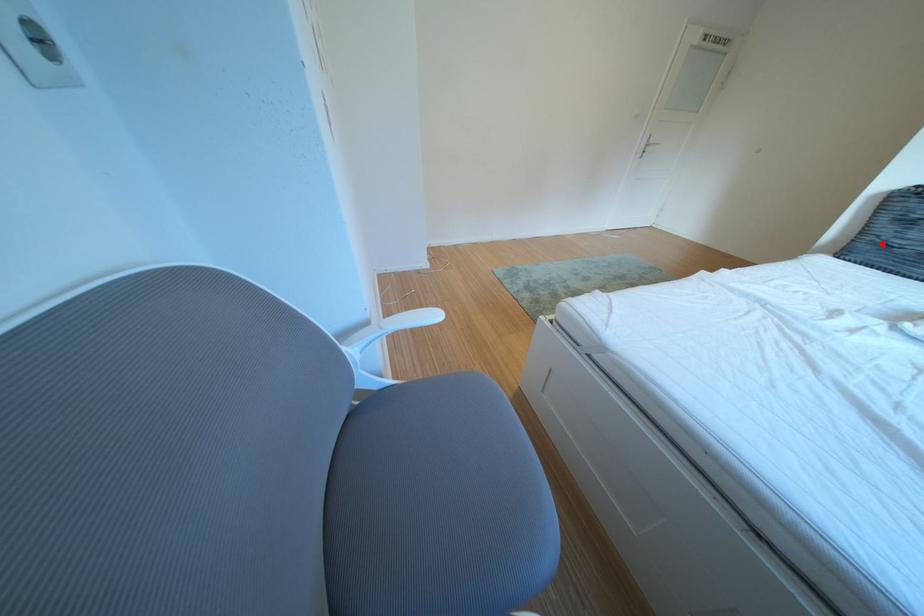
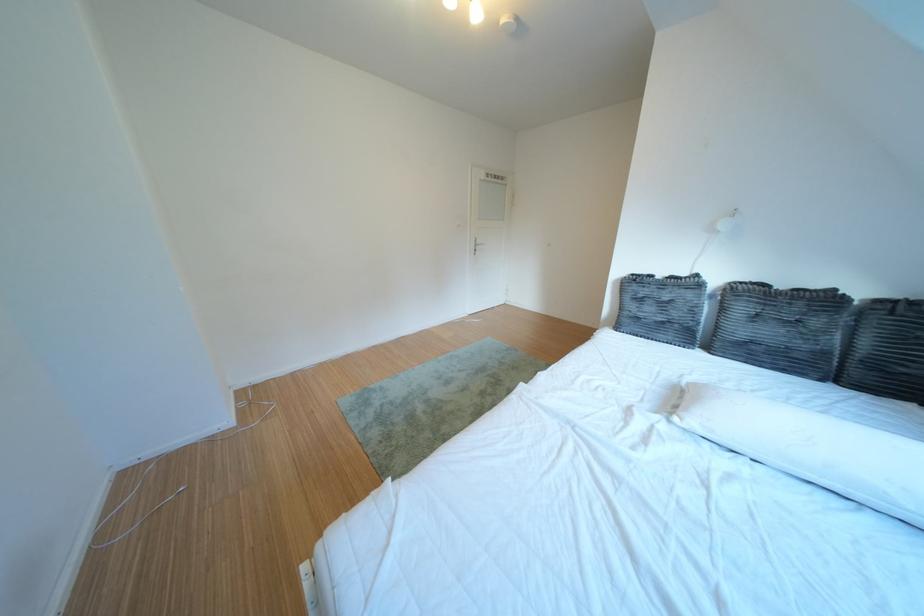
Locate, in the second image, the point that corresponds to the highlighted location in the first image.

(639, 318)